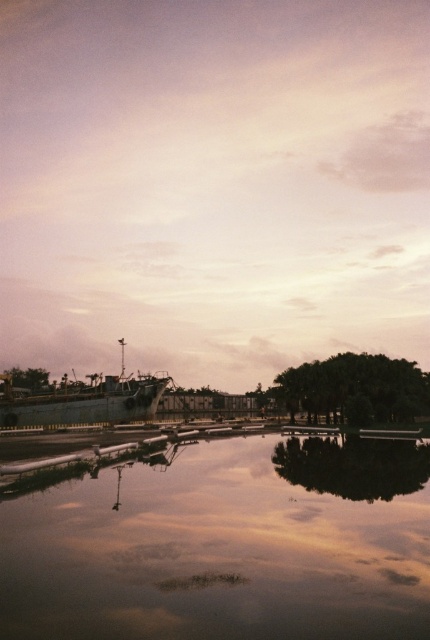
Question: Among these objects, which one is farthest from the camera?

Choices:
 (A) smooth reflective water at center
 (B) rusty metal ship at center

Answer: (B)

Question: Can you confirm if smooth reflective water at center is positioned above rusty metal ship at center?

Choices:
 (A) no
 (B) yes

Answer: (B)

Question: Can you confirm if smooth reflective water at center is bigger than rusty metal ship at center?

Choices:
 (A) no
 (B) yes

Answer: (A)

Question: Which object is closer to the camera taking this photo?

Choices:
 (A) rusty metal ship at center
 (B) smooth reflective water at center

Answer: (B)

Question: Which of the following is the closest to the observer?

Choices:
 (A) (129, 564)
 (B) (104, 413)

Answer: (A)

Question: Does smooth reflective water at center appear over rusty metal ship at center?

Choices:
 (A) yes
 (B) no

Answer: (A)